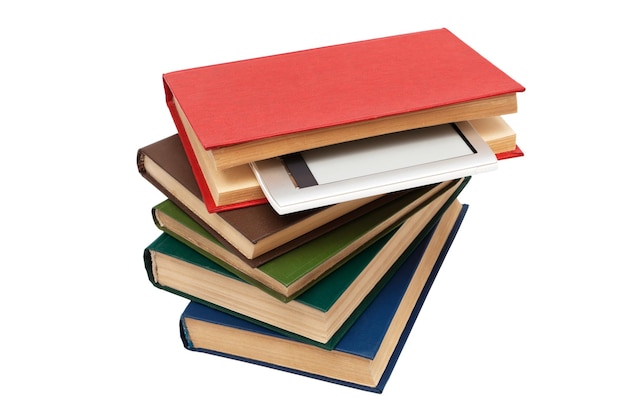
Find the location of `book covers`. book covers is located at coordinates (366, 340), (329, 295), (302, 265), (257, 230), (235, 122).